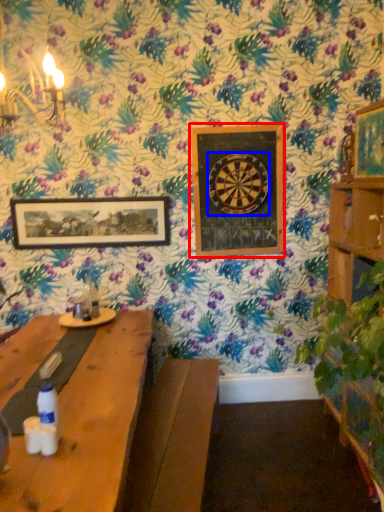
Question: Which object is closer to the camera taking this photo, picture frame (highlighted by a red box) or design (highlighted by a blue box)?

Choices:
 (A) picture frame
 (B) design

Answer: (B)